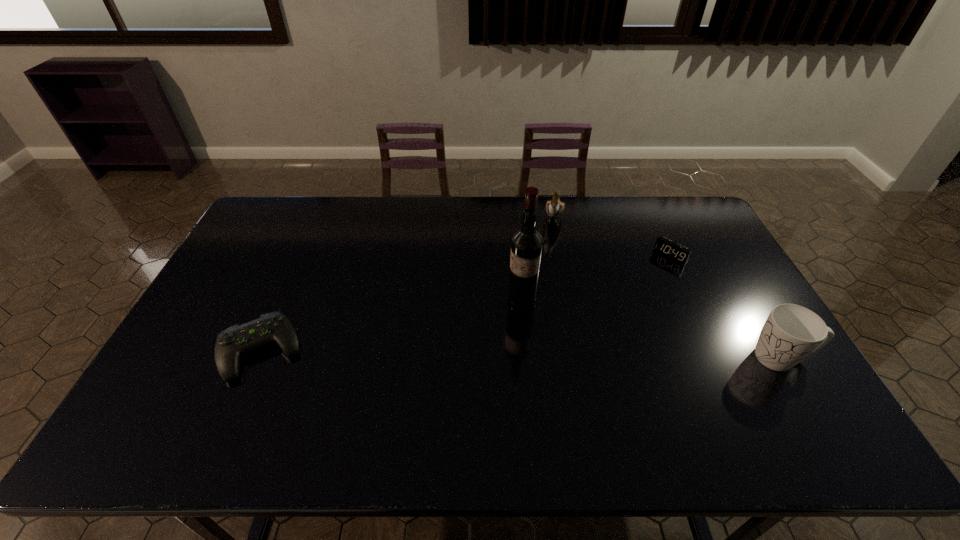
Identify the location of free space in the image that satisfies the following two spatial constraints: 1. on the front side of the leftmost object; 2. on the side of the mug with the handle. The height and width of the screenshot is (540, 960). (257, 357).